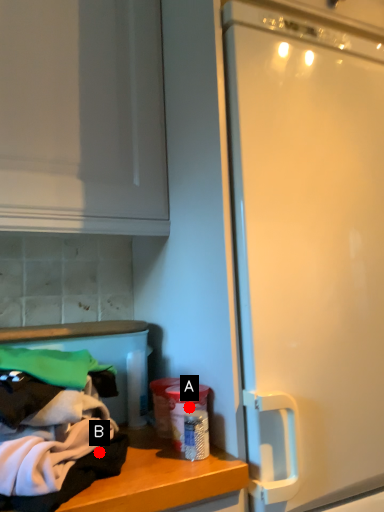
Question: Two points are circled on the image, labeled by A and B beside each circle. Among these points, which one is nearest to the camera?

Choices:
 (A) A is closer
 (B) B is closer

Answer: (B)